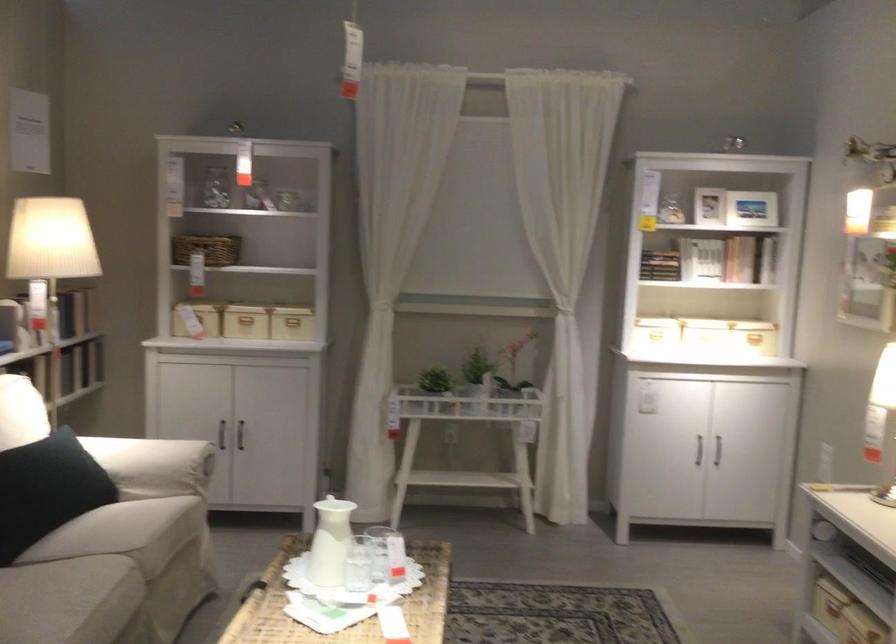
Find where to rest the sofa armrest. Please return your answer as a coordinate pair (x, y).

(152, 465)